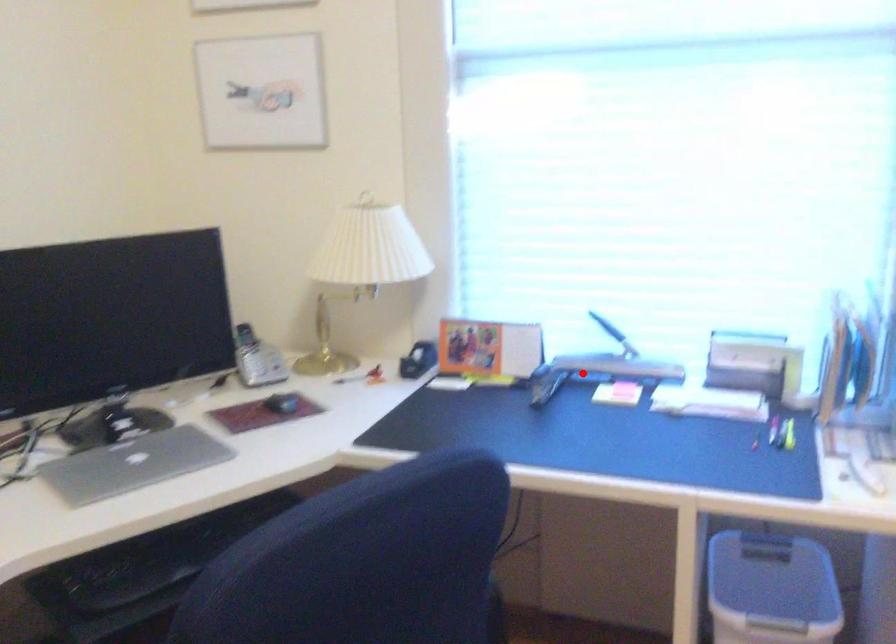
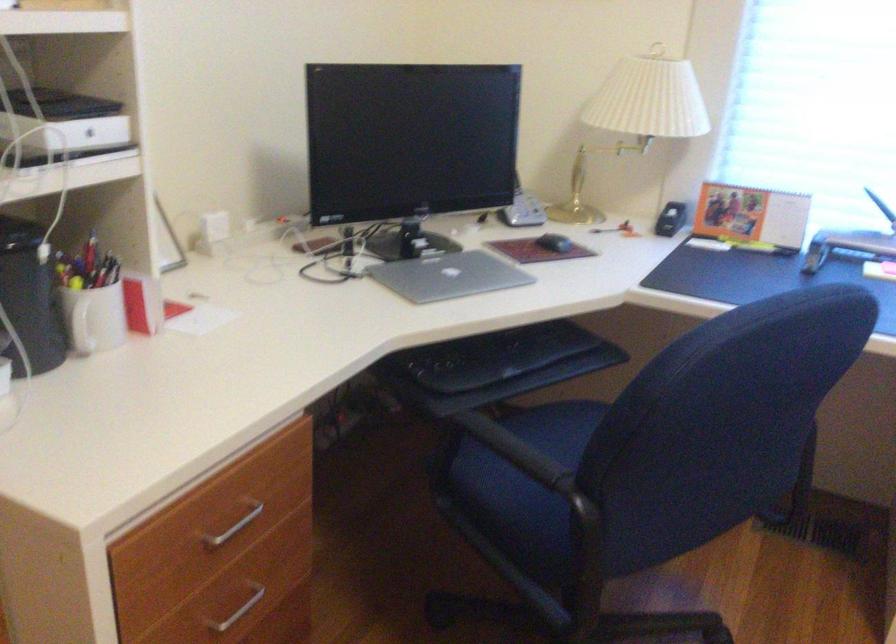
The point at the highlighted location is marked in the first image. Where is the corresponding point in the second image?

(847, 245)